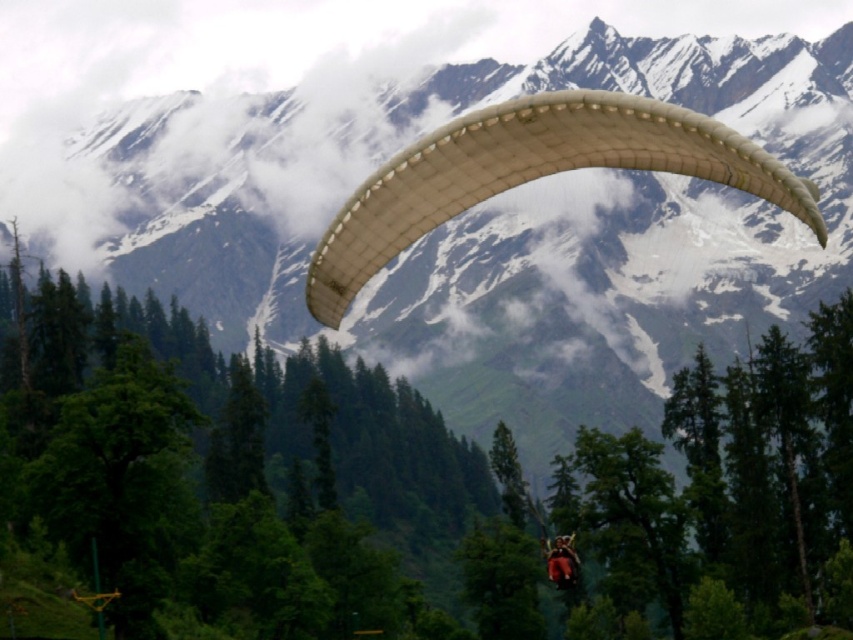
Does point (639, 282) come in front of point (556, 554)?

No.

Is point (468, 337) behind point (550, 561)?

Yes, point (468, 337) is behind point (550, 561).

In the scene shown: Measure the distance between point [758,4] and camera.

667.93 meters

Identify the location of white fabric parachute at upper center. This screenshot has height=640, width=853. click(461, 216).

Looking at this image, is white fabric parachute at upper center to the right of white fabric parachute at center from the viewer's perspective?

No, white fabric parachute at upper center is not to the right of white fabric parachute at center.

Between point (412, 120) and point (709, 148), which one is positioned in front?

Point (709, 148) is more forward.

Is point (190, 166) in front of point (442, 196)?

No, it is behind (442, 196).

You are a GUI agent. You are given a task and a screenshot of the screen. Output one action in this format:
    pyautogui.click(x=<x>, y=<y>)
    Task: Click on the white fabric parachute at upper center
    This screenshot has height=640, width=853.
    Given the screenshot: What is the action you would take?
    pyautogui.click(x=461, y=216)

How much distance is there between white fabric parachute at center and matte white paraglider at center?

A: white fabric parachute at center and matte white paraglider at center are 126.12 meters apart.

Who is shorter, white fabric parachute at center or matte white paraglider at center?

matte white paraglider at center is shorter.

The width and height of the screenshot is (853, 640). In order to click on white fabric parachute at center in this screenshot , I will do `click(532, 173)`.

In order to click on white fabric parachute at center in this screenshot , I will do `click(532, 173)`.